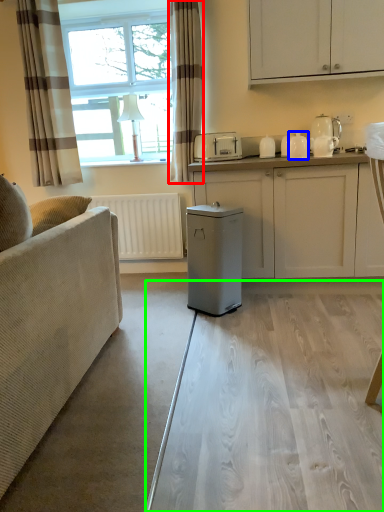
Question: Estimate the real-world distances between objects in this image. Which object is closer to curtain (highlighted by a red box), appliance (highlighted by a blue box) or glass table (highlighted by a green box)?

Choices:
 (A) appliance
 (B) glass table

Answer: (A)